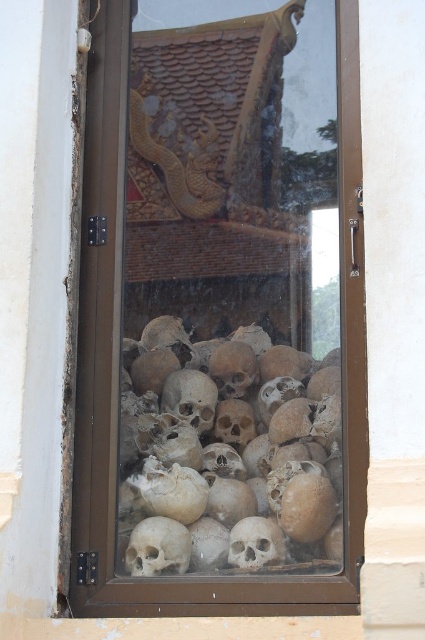
You are an archaeologist examining the glass door. You notice the transparent glass skulls at center and the brown textured skull at center. Which object is wider?

The transparent glass skulls at center is wider than the brown textured skull at center.